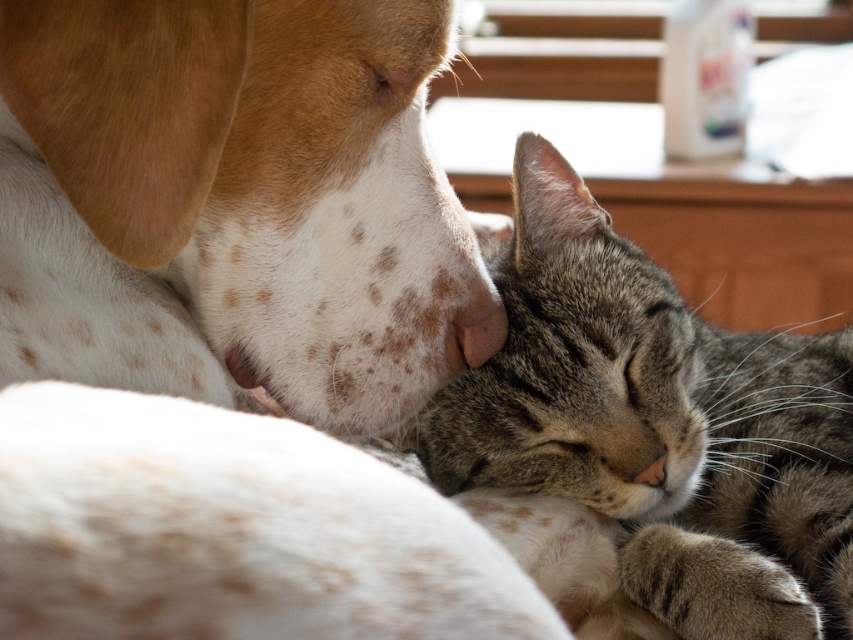
Looking at this image, can you confirm if gray striped fur at center is positioned to the right of gray fur nose at lower right?

Yes, gray striped fur at center is to the right of gray fur nose at lower right.

Is gray striped fur at center to the left of gray fur nose at lower right from the viewer's perspective?

In fact, gray striped fur at center is to the right of gray fur nose at lower right.

Measure the distance between point [524,368] and camera.

They are 99.98 centimeters apart.

Identify the location of gray striped fur at center. Image resolution: width=853 pixels, height=640 pixels. (659, 424).

Consider the image. Is spotted fur dog at upper left above gray striped fur at center?

Yes, spotted fur dog at upper left is above gray striped fur at center.

Is spotted fur dog at upper left to the right of gray striped fur at center from the viewer's perspective?

In fact, spotted fur dog at upper left is to the left of gray striped fur at center.

Is point (445, 230) less distant than point (552, 458)?

Yes.

The height and width of the screenshot is (640, 853). I want to click on spotted fur dog at upper left, so click(229, 202).

Is spotted fur dog at upper left wider than gray fur nose at lower right?

Indeed, spotted fur dog at upper left has a greater width compared to gray fur nose at lower right.

Does point (318, 284) come behind point (485, 358)?

No, it is in front of (485, 358).

Measure the distance between spotted fur dog at upper left and camera.

spotted fur dog at upper left is 22.19 inches away from camera.

At what (x,y) coordinates should I click in order to perform the action: click on spotted fur dog at upper left. Please return your answer as a coordinate pair (x, y). Looking at the image, I should click on (229, 202).